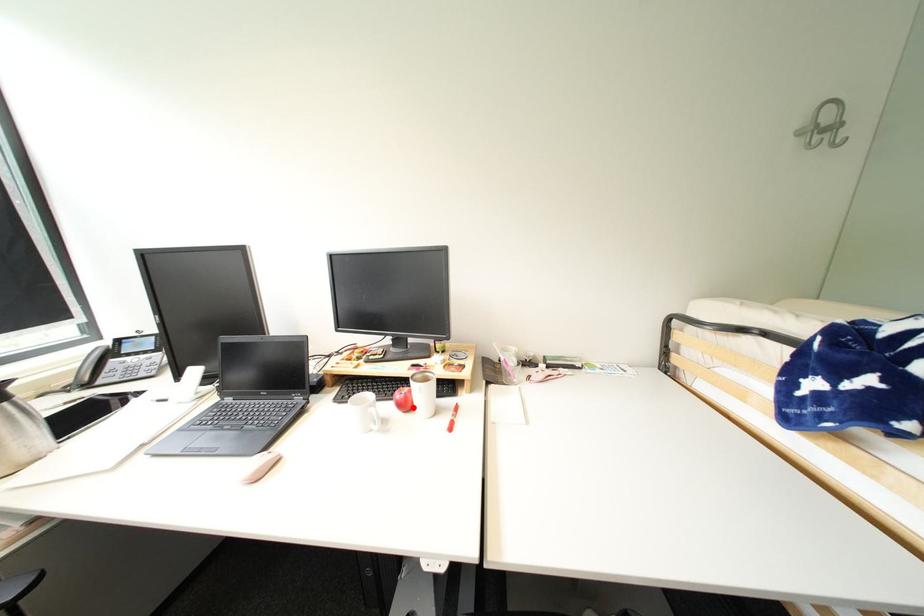
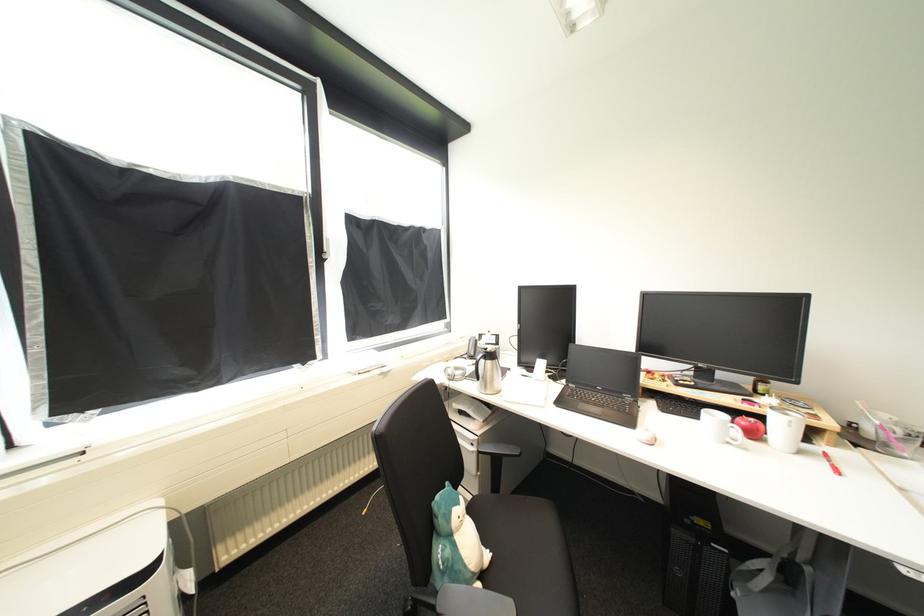
Locate, in the second image, the point that corresponds to the highlighted location in the first image.

(761, 436)